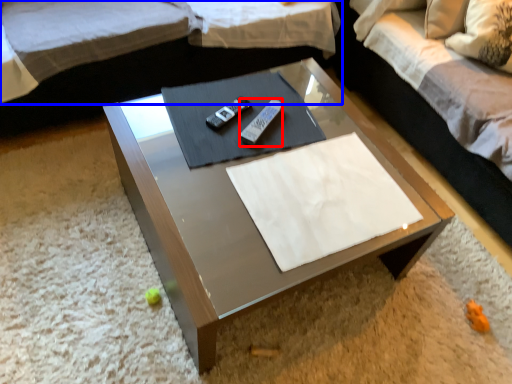
Question: Which object appears closest to the camera in this image, remote (highlighted by a red box) or studio couch (highlighted by a blue box)?

Choices:
 (A) remote
 (B) studio couch

Answer: (B)